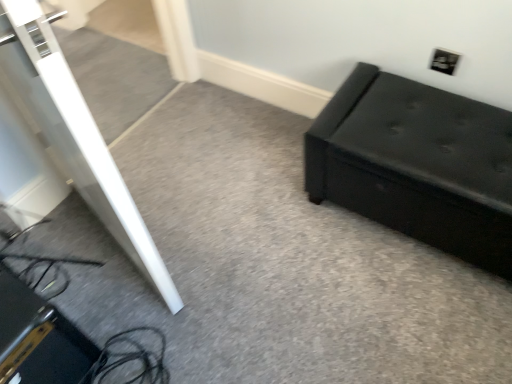
Question: Is black leather ottoman at right smaller than black plastic electric outlet at upper right?

Choices:
 (A) no
 (B) yes

Answer: (A)

Question: Does black leather ottoman at right have a greater height compared to black plastic electric outlet at upper right?

Choices:
 (A) no
 (B) yes

Answer: (B)

Question: Does black leather ottoman at right have a greater width compared to black plastic electric outlet at upper right?

Choices:
 (A) no
 (B) yes

Answer: (B)

Question: Can you confirm if black leather ottoman at right is thinner than black plastic electric outlet at upper right?

Choices:
 (A) no
 (B) yes

Answer: (A)

Question: Is black leather ottoman at right outside of black plastic electric outlet at upper right?

Choices:
 (A) no
 (B) yes

Answer: (B)

Question: Is black leather ottoman at right shorter than black plastic electric outlet at upper right?

Choices:
 (A) no
 (B) yes

Answer: (A)

Question: Does black plastic electric outlet at upper right have a greater height compared to black leather ottoman at right?

Choices:
 (A) yes
 (B) no

Answer: (B)

Question: Can you confirm if black plastic electric outlet at upper right is shorter than black leather ottoman at right?

Choices:
 (A) no
 (B) yes

Answer: (B)

Question: Is black plastic electric outlet at upper right directly adjacent to black leather ottoman at right?

Choices:
 (A) yes
 (B) no

Answer: (B)

Question: Does black plastic electric outlet at upper right have a smaller size compared to black leather ottoman at right?

Choices:
 (A) yes
 (B) no

Answer: (A)

Question: Does black plastic electric outlet at upper right lie behind black leather ottoman at right?

Choices:
 (A) no
 (B) yes

Answer: (B)

Question: Does black plastic electric outlet at upper right appear on the left side of black leather ottoman at right?

Choices:
 (A) yes
 (B) no

Answer: (B)

Question: From a real-world perspective, is black plastic electric outlet at upper right physically located above or below black leather ottoman at right?

Choices:
 (A) above
 (B) below

Answer: (A)